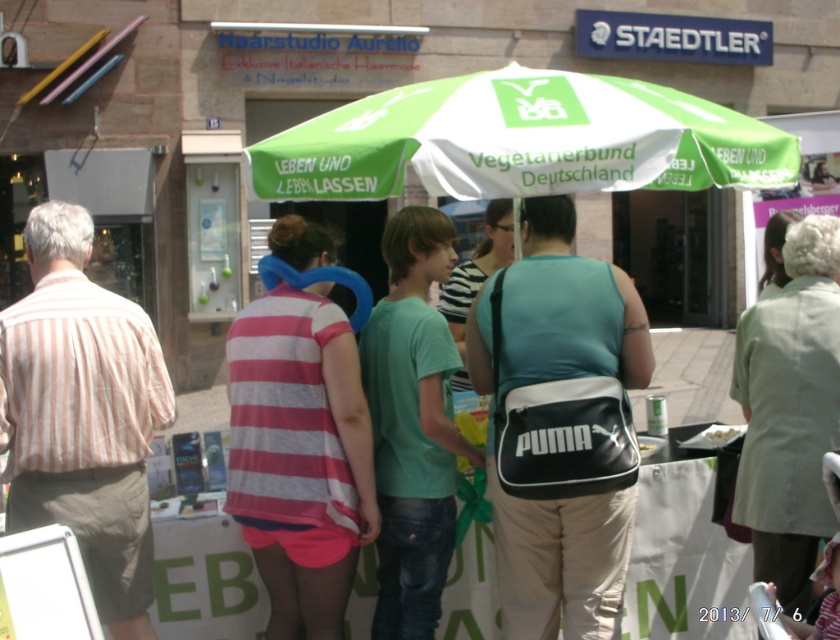
You are at the event and want to move from the striped cotton shirt at left to the green fabric umbrella at center. Which direction should you move?

You should move to the right to go from the striped cotton shirt at left to the green fabric umbrella at center since the green fabric umbrella at center is to the right of the striped cotton shirt at left.

What object is located at the coordinates point (520,140) in the image?

The point (520,140) marks the green fabric umbrella at center.

You are a photographer trying to capture a photo of the striped cotton shirt at left and the green fabric umbrella at center. Based on their heights, which object should you focus on first to ensure it fits entirely in the frame?

The striped cotton shirt at left is taller than the green fabric umbrella at center, so you should focus on the striped cotton shirt at left first to ensure it fits entirely in the frame.